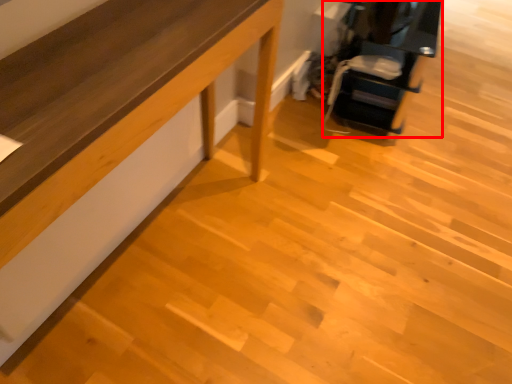
Question: From the image's perspective, where is furniture (annotated by the red box) located in relation to furniture in the image?

Choices:
 (A) above
 (B) below

Answer: (A)